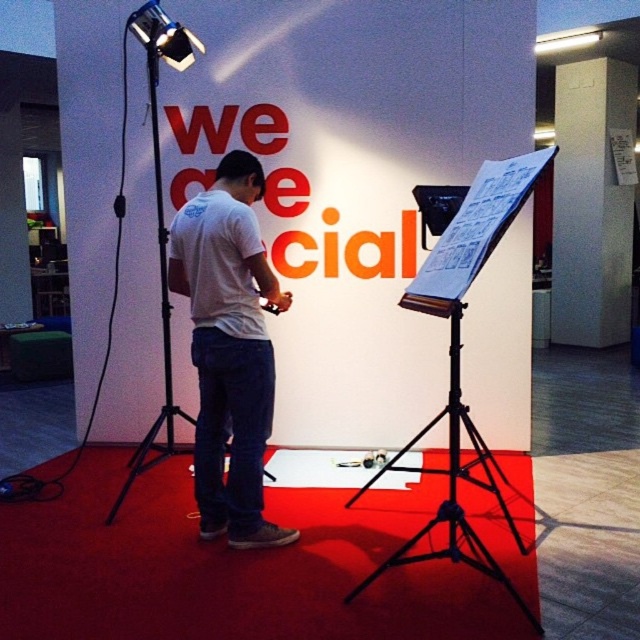
Question: Among these points, which one is nearest to the camera?

Choices:
 (A) click(592, 244)
 (B) click(163, 33)

Answer: (B)

Question: Is black metal tripod at center positioned at the back of black metal tripod at left?

Choices:
 (A) yes
 (B) no

Answer: (B)

Question: Which object appears closest to the camera in this image?

Choices:
 (A) black metal tripod at center
 (B) black metal tripod at left
 (C) white matte t-shirt at center
 (D) metallic projector at upper left

Answer: (A)

Question: Among these points, which one is nearest to the camera?

Choices:
 (A) (596, 230)
 (B) (212, 280)

Answer: (B)

Question: Can you confirm if black metal tripod at center is smaller than black metal tripod at left?

Choices:
 (A) yes
 (B) no

Answer: (B)

Question: From the image, what is the correct spatial relationship of white smooth pillar at upper right in relation to black metal tripod at center?

Choices:
 (A) left
 (B) right

Answer: (B)